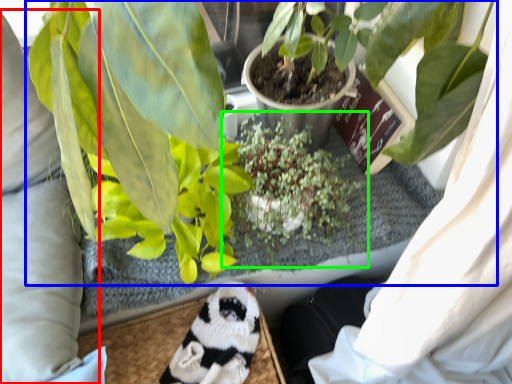
Question: Considering the real-world distances, which object is farthest from clothing (highlighted by a red box)? houseplant (highlighted by a blue box) or houseplant (highlighted by a green box)?

Choices:
 (A) houseplant
 (B) houseplant

Answer: (A)